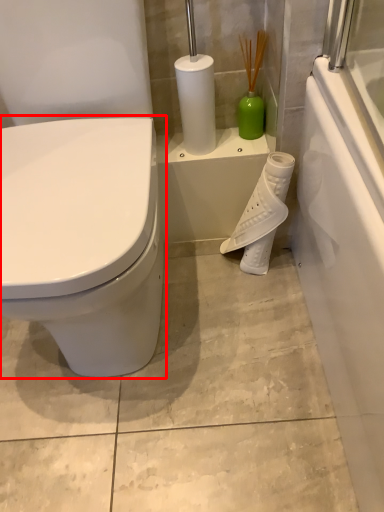
Question: In this image, where is toilet (annotated by the red box) located relative to toilet paper?

Choices:
 (A) right
 (B) left

Answer: (B)